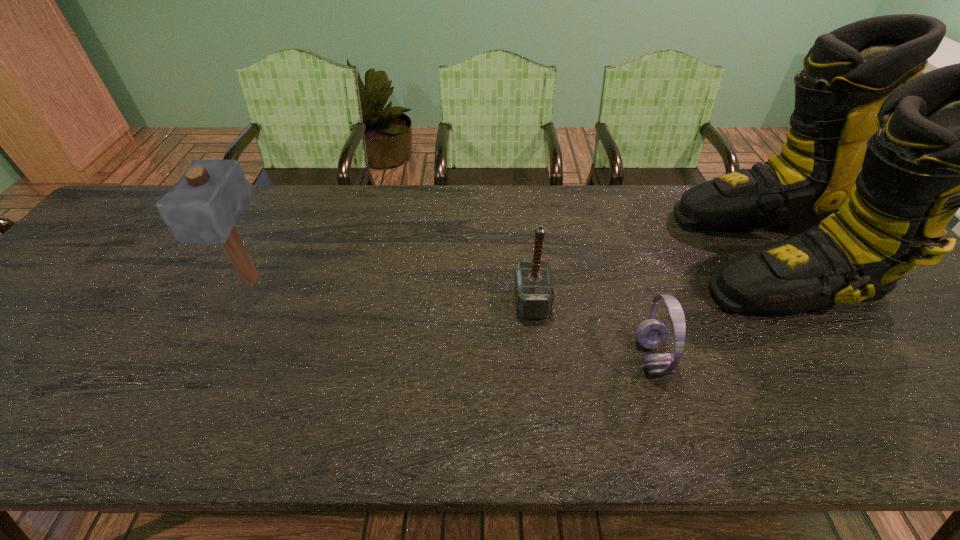
What are the coordinates of `the rightmost object` in the screenshot? It's located at (878, 159).

The image size is (960, 540). What are the coordinates of `the tallest object` in the screenshot? It's located at (878, 159).

Where is `mallet`? The height and width of the screenshot is (540, 960). mallet is located at coordinates (203, 206).

I want to click on the leftmost object, so click(x=203, y=206).

Locate an element on the screen. The width and height of the screenshot is (960, 540). the second shortest object is located at coordinates (534, 294).

This screenshot has width=960, height=540. I want to click on the second object from left to right, so click(x=534, y=294).

In order to click on headset in this screenshot , I will do `click(651, 333)`.

Locate an element on the screen. This screenshot has width=960, height=540. the shortest object is located at coordinates (651, 333).

Find the location of a particular element. free region located 0.110m on the front of the tallest object is located at coordinates (848, 366).

You are a GUI agent. You are given a task and a screenshot of the screen. Output one action in this format:
    pyautogui.click(x=<x>, y=<y>)
    Task: Click on the vacant space situated 0.120m on the left of the mallet
    
    Given the screenshot: What is the action you would take?
    pyautogui.click(x=184, y=281)